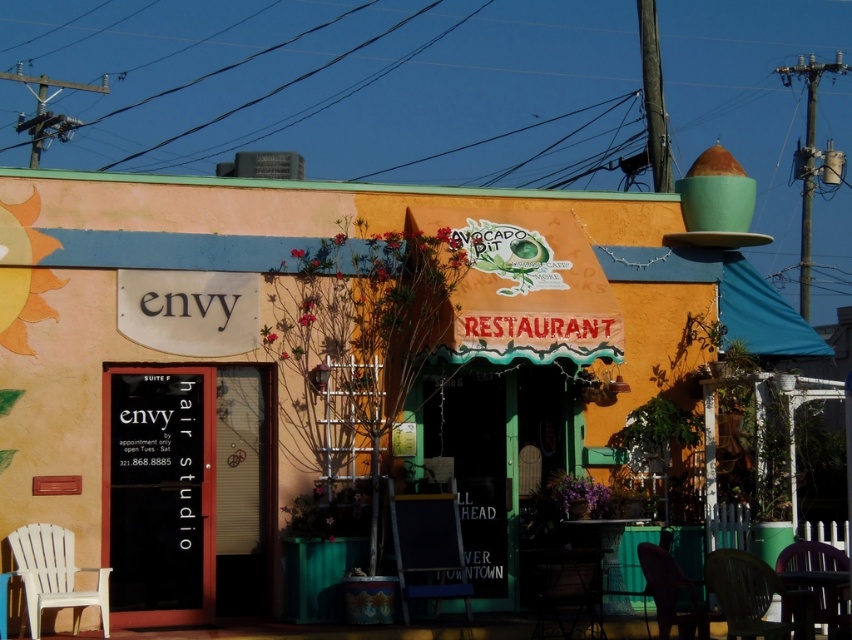
You are a customer arriving at the storefront and want to sit down while waiting for your appointment. You see a black plastic chair at center and a plastic chair at lower right. Which chair is closer to the entrance of Envy Hair Studio?

The black plastic chair at center is closer to the entrance of Envy Hair Studio because it is positioned to the left of the plastic chair at lower right, and the entrance is on the left side of the image.

In the scene shown: You are a customer waiting to enter the Avocado Pit Restaurant. You see a green plastic chair at lower right and a metallic dark brown chair at lower center. Which chair is closer to the ground?

The green plastic chair at lower right is shorter than the metallic dark brown chair at lower center, so it is closer to the ground.

You are standing in front of the storefront and want to sit on one of the chairs. Which chair, the black plastic chair at center or the plastic chair at lower right, is closer to you?

The black plastic chair at center is closer to you because it is further to the viewer than the plastic chair at lower right.